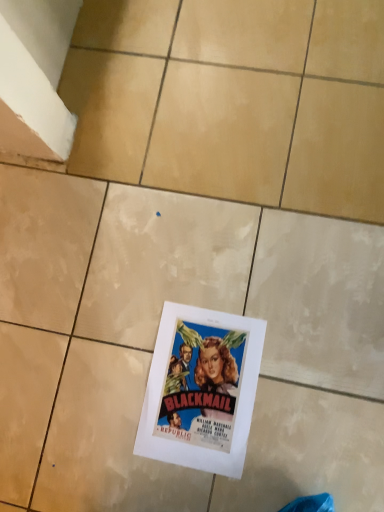
Where is `vacant space that is to the left of matte paper poster at center`? vacant space that is to the left of matte paper poster at center is located at coordinates [98, 423].